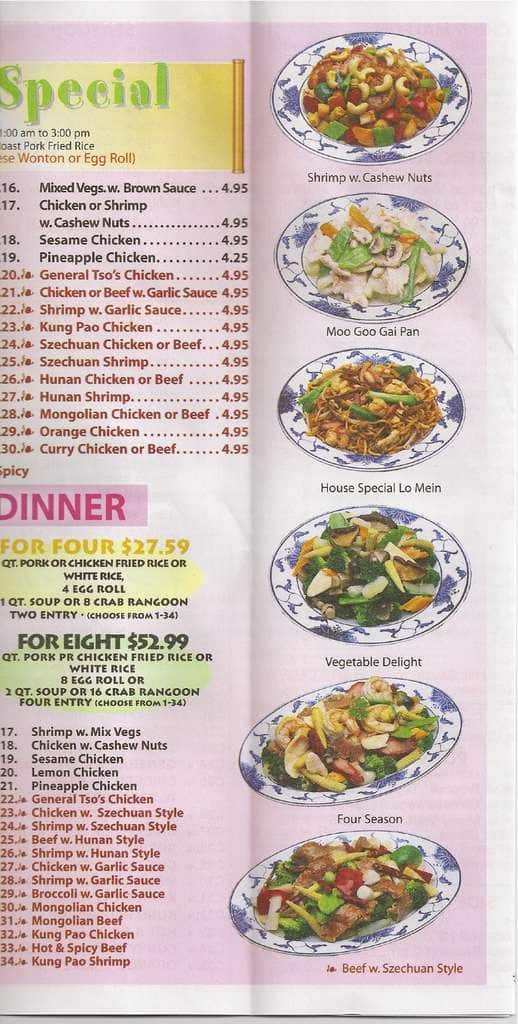
Where is `plates`? plates is located at coordinates (240, 895), (280, 791), (382, 639), (388, 462), (435, 292), (450, 124).